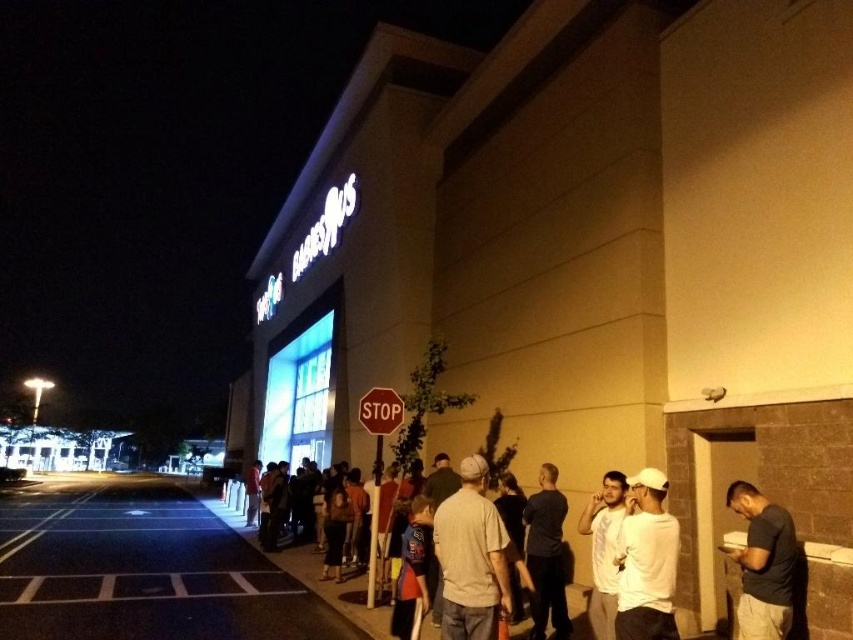
From the picture: You are a pedestrian standing on the sidewalk in front of the Babies R Us store. You see the dark gray shirt at center and the red matte stop sign at center. Which object is closer to the ground?

The dark gray shirt at center is positioned under the red matte stop sign at center, so the dark gray shirt at center is closer to the ground.

In the scene shown: You are standing at the entrance of the Babies R Us store and see two points marked on the sidewalk in front of you. The first point is at coordinate point (129,580) and the second is at point (387,396). If you want to walk towards the second point, which direction should you move relative to the first point?

Since point (129,580) is behind point (387,396), you should move forward towards the second point from the first point.